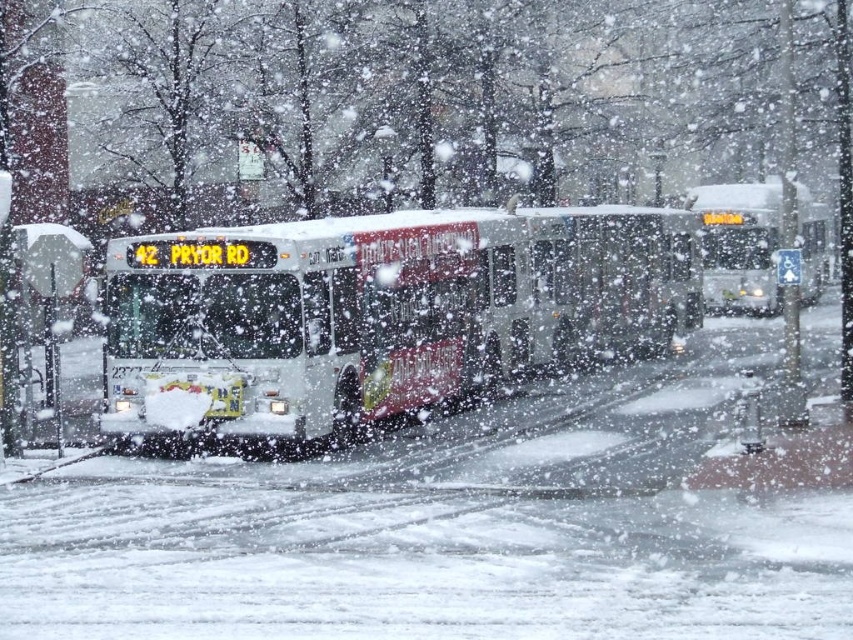
Can you confirm if white metallic bus at center is positioned above white glossy bus at center?

No, white metallic bus at center is not above white glossy bus at center.

Consider the image. Can you confirm if white metallic bus at center is smaller than white glossy bus at center?

Indeed, white metallic bus at center has a smaller size compared to white glossy bus at center.

Find the location of a particular element. This screenshot has height=640, width=853. white metallic bus at center is located at coordinates (384, 310).

Identify the location of white metallic bus at center. This screenshot has height=640, width=853. (384, 310).

Locate an element on the screen. The width and height of the screenshot is (853, 640). white glossy bus at center is located at coordinates (738, 244).

Where is `white glossy bus at center`? This screenshot has width=853, height=640. white glossy bus at center is located at coordinates (738, 244).

What are the coordinates of `white metallic bus at center` in the screenshot? It's located at (384, 310).

Find the location of a particular element. white metallic bus at center is located at coordinates (384, 310).